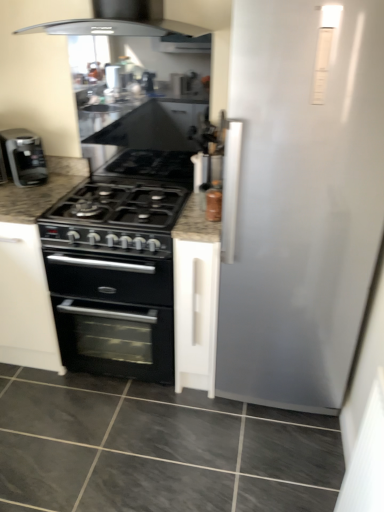
Find the location of a particular element. The height and width of the screenshot is (512, 384). free location above gray marble floor at lower center (from a real-world perspective) is located at coordinates click(x=147, y=433).